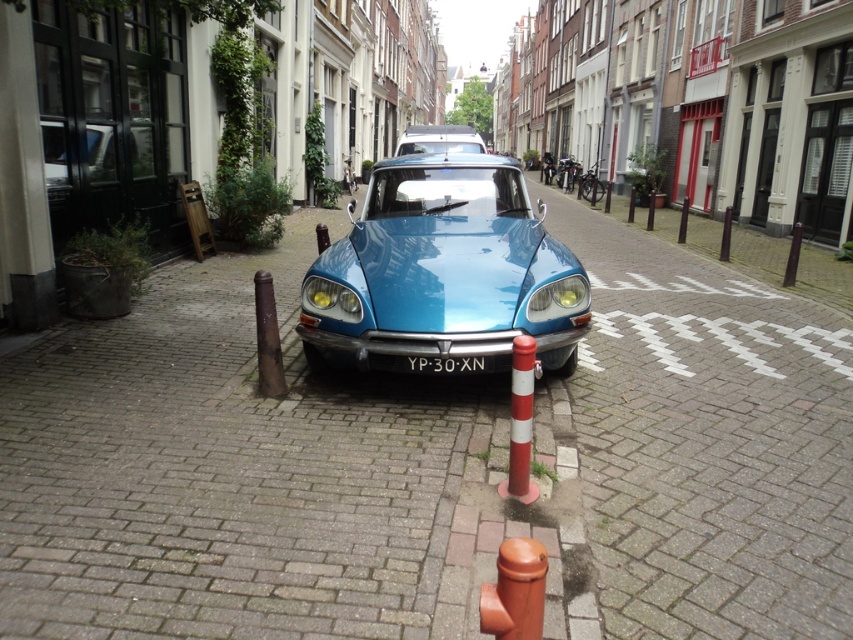
Question: Which object is closer to the camera taking this photo?

Choices:
 (A) shiny silver car at center
 (B) matte blue car at center

Answer: (B)

Question: Estimate the real-world distances between objects in this image. Which object is closer to the black plastic license plate at center?

Choices:
 (A) matte blue car at center
 (B) shiny silver car at center
 (C) smooth brick pavement at center

Answer: (A)

Question: Which of the following is the farthest from the observer?

Choices:
 (A) (498, 305)
 (B) (42, 458)

Answer: (A)

Question: Can you confirm if smooth brick pavement at center is wider than black plastic license plate at center?

Choices:
 (A) yes
 (B) no

Answer: (A)

Question: Can you confirm if matte blue car at center is positioned above shiny silver car at center?

Choices:
 (A) yes
 (B) no

Answer: (B)

Question: Can you confirm if matte blue car at center is bigger than brown matte hydrant at lower center?

Choices:
 (A) no
 (B) yes

Answer: (B)